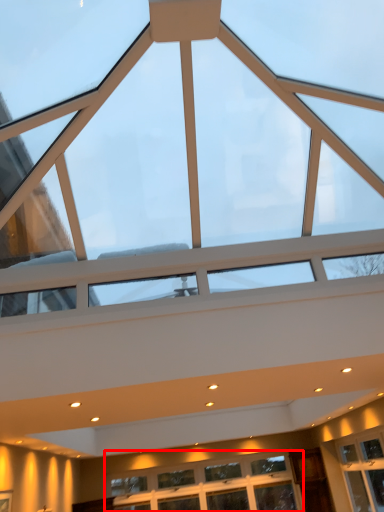
Question: Where is window (annotated by the red box) located in relation to window in the image?

Choices:
 (A) left
 (B) right

Answer: (B)